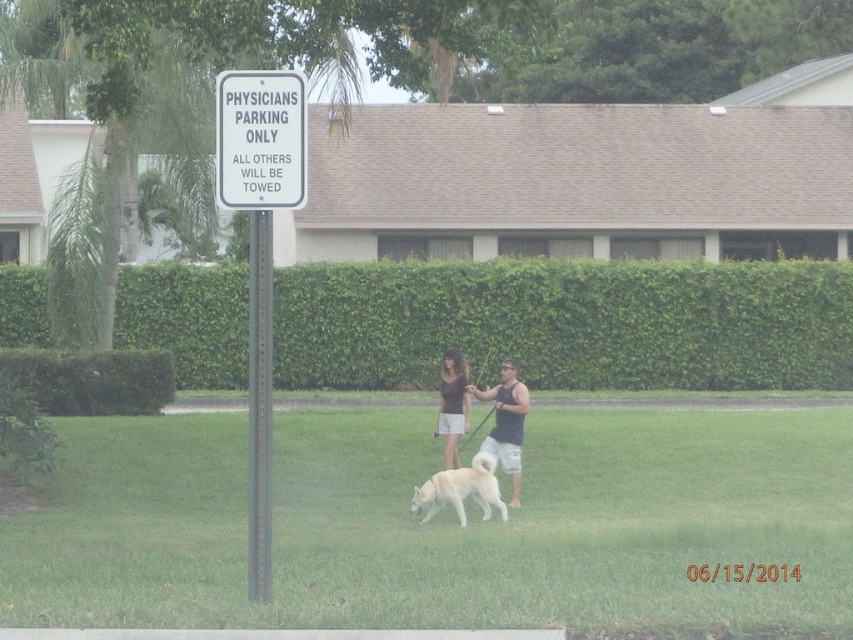
Question: Does green leafy hedge at center appear under dark brown fabric shirt at center?

Choices:
 (A) yes
 (B) no

Answer: (B)

Question: Does metallic pole at center appear on the left side of dark brown fabric shirt at center?

Choices:
 (A) yes
 (B) no

Answer: (A)

Question: Which of the following is the farthest from the observer?

Choices:
 (A) (467, 392)
 (B) (451, 496)
 (C) (520, 429)

Answer: (A)

Question: Can you confirm if matte brown hair at center is bigger than dark brown fabric shirt at center?

Choices:
 (A) no
 (B) yes

Answer: (A)

Question: Estimate the real-world distances between objects in this image. Which object is closer to the white plastic sign at upper center?

Choices:
 (A) white fur dog at center
 (B) matte brown hair at center

Answer: (A)

Question: Which object is the farthest from the dark brown fabric shirt at center?

Choices:
 (A) matte brown hair at center
 (B) green leafy hedge at center
 (C) metallic pole at center
 (D) white plastic sign at upper center

Answer: (D)